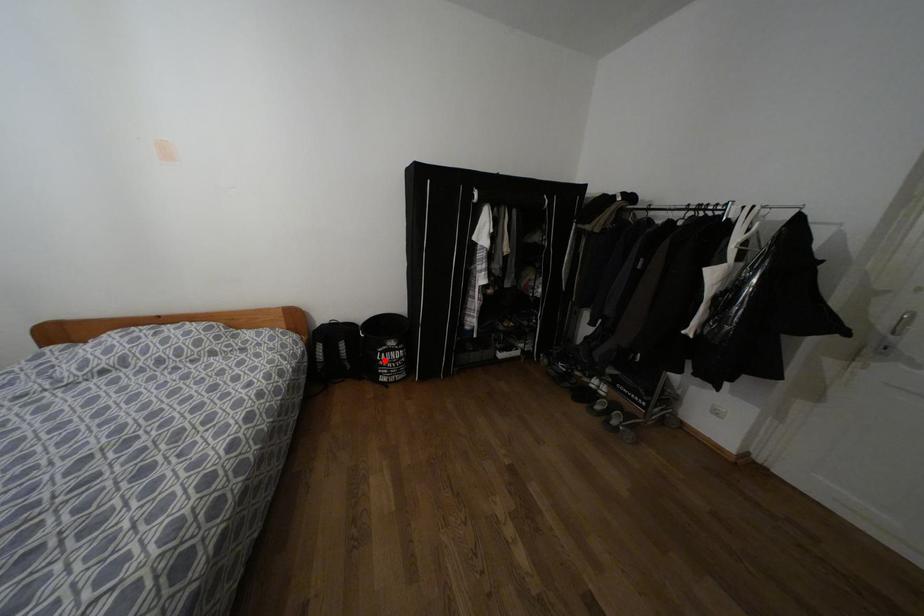
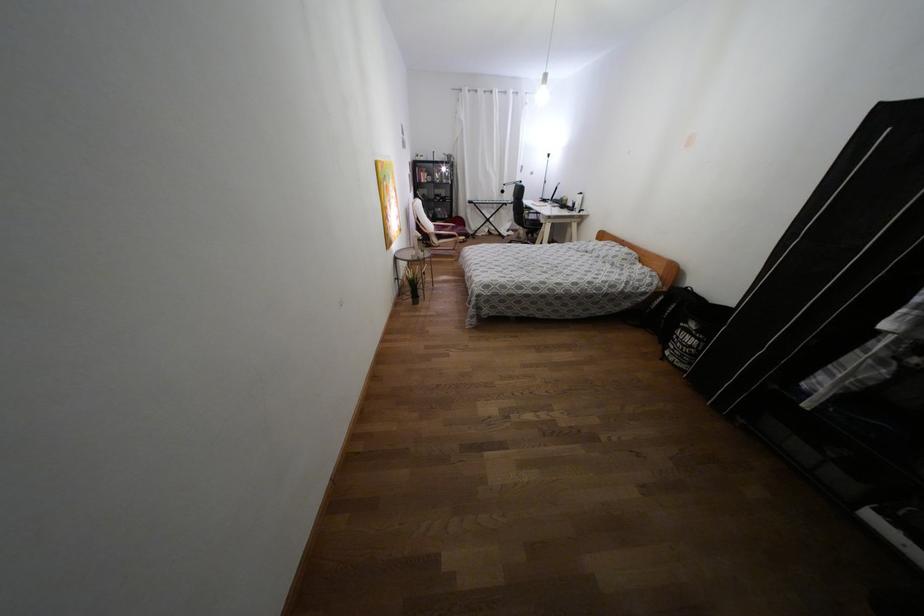
Question: I am providing you with two images of the same scene from different viewpoints. Given a red point in image1, look at the same physical point in image2. Is it:

Choices:
 (A) Closer to the viewpoint
 (B) Farther from the viewpoint

Answer: (A)